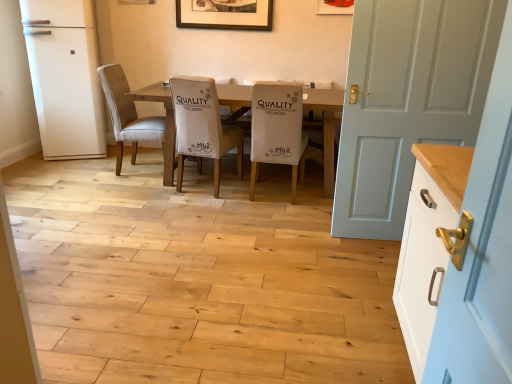
Question: Is white painted wood cabinet at right beside beige fabric chair at center, arranged as the third chair when viewed from the left?

Choices:
 (A) yes
 (B) no

Answer: (B)

Question: From the image's perspective, is white painted wood cabinet at right located above beige fabric chair at center, arranged as the third chair when viewed from the left?

Choices:
 (A) no
 (B) yes

Answer: (A)

Question: Is white painted wood cabinet at right taller than beige fabric chair at center, arranged as the third chair when viewed from the left?

Choices:
 (A) no
 (B) yes

Answer: (A)

Question: Is beige fabric chair at center, the 1th chair in the right-to-left sequence, surrounded by white painted wood cabinet at right?

Choices:
 (A) no
 (B) yes

Answer: (A)

Question: Can you confirm if white painted wood cabinet at right is bigger than beige fabric chair at center, arranged as the third chair when viewed from the left?

Choices:
 (A) yes
 (B) no

Answer: (B)

Question: From a real-world perspective, is white painted wood cabinet at right physically below beige fabric chair at center, the 1th chair in the right-to-left sequence?

Choices:
 (A) yes
 (B) no

Answer: (A)

Question: From a real-world perspective, is matte white picture frame at upper center, arranged as the second picture frame when viewed from the left, physically above white matte refrigerator at left?

Choices:
 (A) yes
 (B) no

Answer: (A)

Question: Considering the relative sizes of matte white picture frame at upper center, which is the first picture frame in right-to-left order, and white matte refrigerator at left in the image provided, is matte white picture frame at upper center, which is the first picture frame in right-to-left order, taller than white matte refrigerator at left?

Choices:
 (A) yes
 (B) no

Answer: (B)

Question: Is matte white picture frame at upper center, which is the first picture frame in right-to-left order, shorter than white matte refrigerator at left?

Choices:
 (A) no
 (B) yes

Answer: (B)

Question: Is matte white picture frame at upper center, marked as the 2th picture frame in a back-to-front arrangement, positioned behind white matte refrigerator at left?

Choices:
 (A) no
 (B) yes

Answer: (B)

Question: From the image's perspective, would you say matte white picture frame at upper center, marked as the 2th picture frame in a back-to-front arrangement, is shown under white matte refrigerator at left?

Choices:
 (A) yes
 (B) no

Answer: (B)

Question: Considering the relative sizes of matte white picture frame at upper center, which is the first picture frame in right-to-left order, and white matte refrigerator at left in the image provided, is matte white picture frame at upper center, which is the first picture frame in right-to-left order, bigger than white matte refrigerator at left?

Choices:
 (A) no
 (B) yes

Answer: (A)

Question: Does wooden picture frame at upper center, positioned as the first picture frame in left-to-right order, have a smaller size compared to white fabric chair at center, which appears as the second chair when viewed from the right?

Choices:
 (A) yes
 (B) no

Answer: (A)